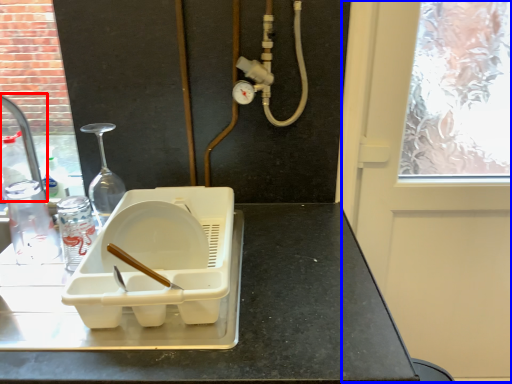
Question: Which point is further to the camera, faucet (highlighted by a red box) or screen door (highlighted by a blue box)?

Choices:
 (A) faucet
 (B) screen door

Answer: (A)